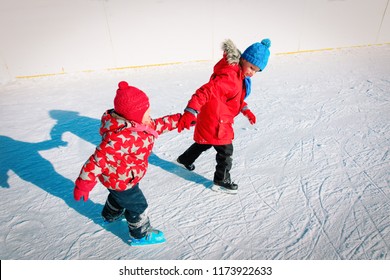
At what (x,y) coordinates should I click in order to perform the action: click on white wall. Please return your answer as a coordinate pair (x, y). Image resolution: width=390 pixels, height=280 pixels. Looking at the image, I should click on tap(133, 17), tap(293, 8), tap(42, 17).